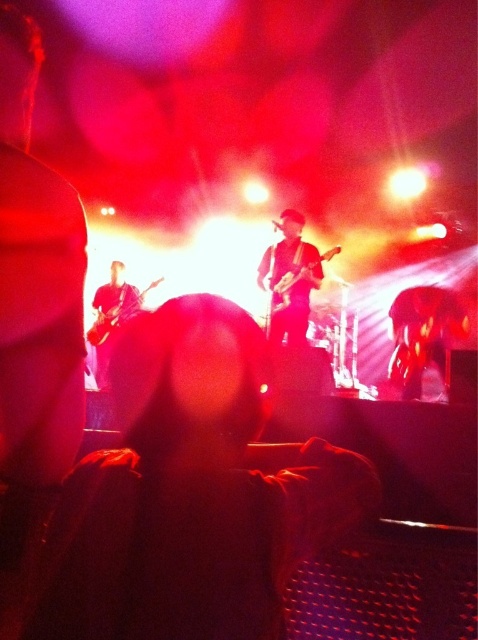
Who is positioned more to the right, black leather jacket at center or shiny black guitar at center?

Positioned to the right is shiny black guitar at center.

Can you confirm if black leather jacket at center is positioned to the right of shiny black guitar at center?

No, black leather jacket at center is not to the right of shiny black guitar at center.

Where is `black leather jacket at center`? This screenshot has width=478, height=640. black leather jacket at center is located at coordinates [188, 493].

Does shiny black guitar at center appear on the left side of glossy black guitar at left?

No, shiny black guitar at center is not to the left of glossy black guitar at left.

Is shiny black guitar at center below glossy black guitar at left?

Incorrect, shiny black guitar at center is not positioned below glossy black guitar at left.

Which is in front, point (285, 244) or point (100, 305)?

Point (285, 244) is more forward.

Identify the location of shiny black guitar at center. (290, 278).

Can you confirm if black leather jacket at center is positioned to the left of glossy black guitar at left?

No, black leather jacket at center is not to the left of glossy black guitar at left.

Find the location of a particular element. This screenshot has width=478, height=640. black leather jacket at center is located at coordinates (188, 493).